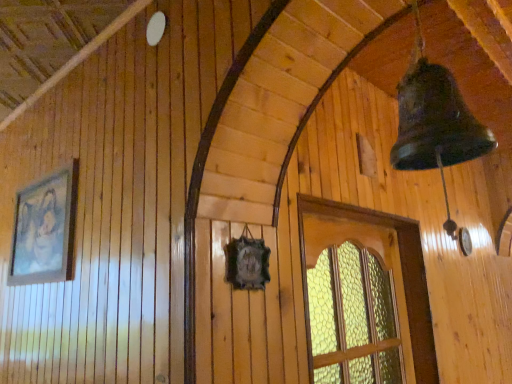
Question: Choose the correct answer: Is translucent glass window at center inside matte wooden picture frame at left or outside it?

Choices:
 (A) inside
 (B) outside

Answer: (B)

Question: Looking at the image, does translucent glass window at center seem bigger or smaller compared to matte wooden picture frame at left?

Choices:
 (A) small
 (B) big

Answer: (B)

Question: Relative to matte wooden picture frame at left, is translucent glass window at center in front or behind?

Choices:
 (A) behind
 (B) front

Answer: (B)

Question: From the image's perspective, relative to translucent glass window at center, is matte wooden picture frame at left above or below?

Choices:
 (A) above
 (B) below

Answer: (A)

Question: In terms of size, does matte wooden picture frame at left appear bigger or smaller than translucent glass window at center?

Choices:
 (A) big
 (B) small

Answer: (B)

Question: From their relative heights in the image, would you say matte wooden picture frame at left is taller or shorter than translucent glass window at center?

Choices:
 (A) short
 (B) tall

Answer: (A)

Question: From a real-world perspective, is matte wooden picture frame at left above or below translucent glass window at center?

Choices:
 (A) below
 (B) above

Answer: (B)